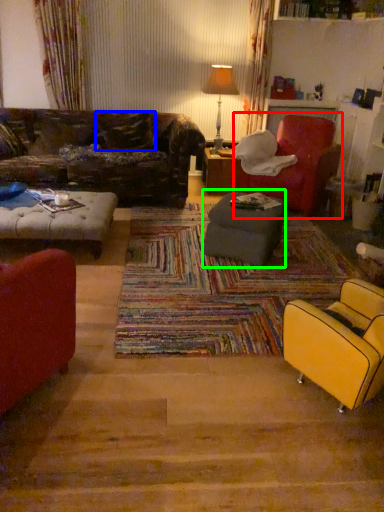
Question: Based on their relative distances, which object is nearer to chair (highlighted by a red box)? Choose from pillow (highlighted by a blue box) and table (highlighted by a green box).

Choices:
 (A) pillow
 (B) table

Answer: (B)